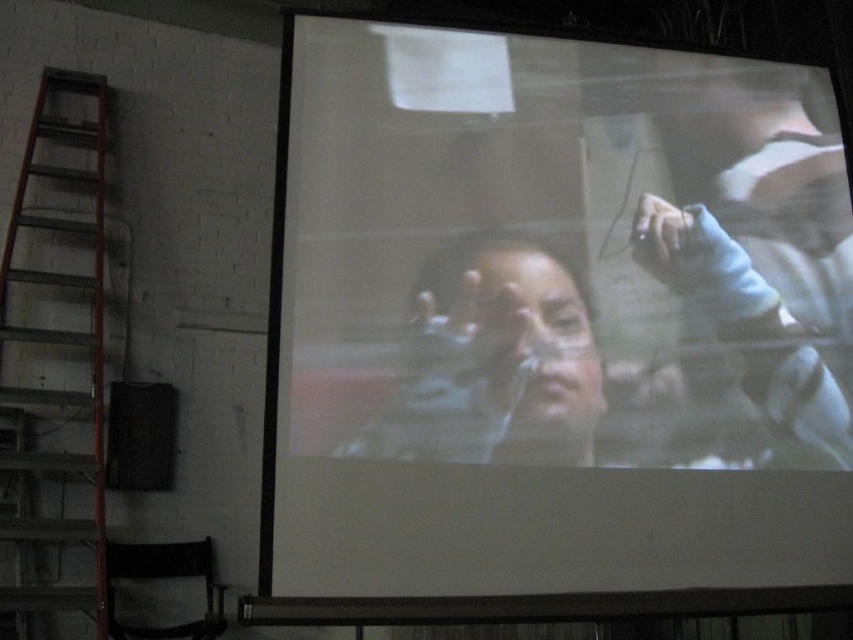
Question: Which of the following is the farthest from the observer?

Choices:
 (A) (21, 444)
 (B) (708, 269)

Answer: (A)

Question: Which object is positioned farthest from the smooth skin face at center?

Choices:
 (A) metallic orange ladder at left
 (B) white matte projection screen at center

Answer: (A)

Question: Is smooth skin face at center wider than metallic orange ladder at left?

Choices:
 (A) no
 (B) yes

Answer: (B)

Question: In this image, where is smooth skin face at center located relative to metallic orange ladder at left?

Choices:
 (A) right
 (B) left

Answer: (A)

Question: Is smooth skin face at center bigger than metallic orange ladder at left?

Choices:
 (A) yes
 (B) no

Answer: (B)

Question: Which of the following is the farthest from the observer?

Choices:
 (A) white matte projection screen at center
 (B) smooth skin face at center

Answer: (B)